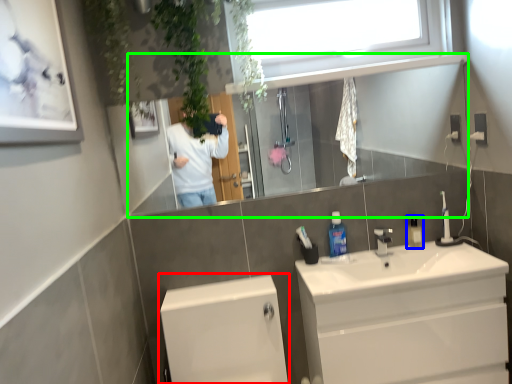
Question: Which object is positioned farthest from bath (highlighted by a red box)? Select from mouthwash (highlighted by a blue box) and mirror (highlighted by a green box).

Choices:
 (A) mouthwash
 (B) mirror

Answer: (A)